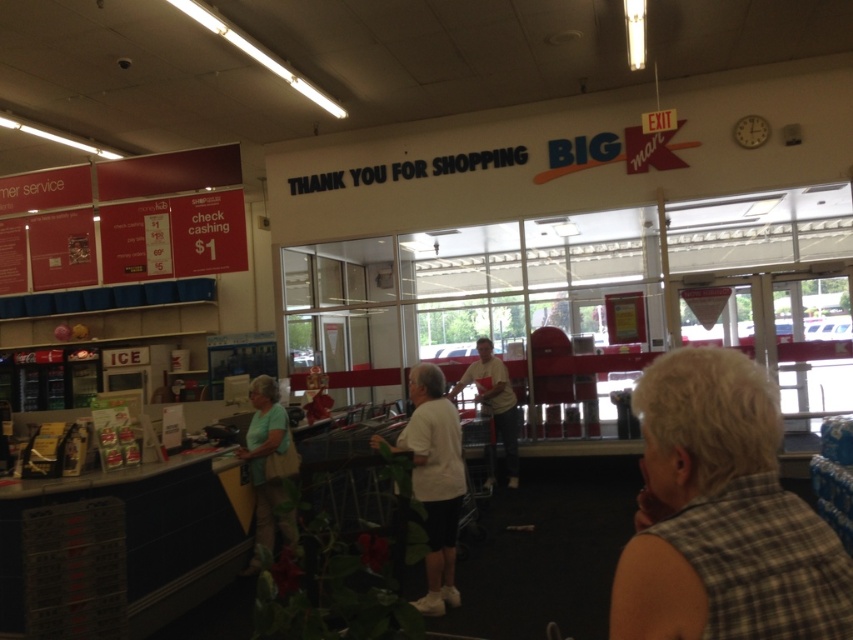
You are a customer at the Big Kmart checkout line. You notice two shirts displayed on mannequins near the checkout counter. The brown plaid shirt at lower right and the white matte shirt at center. Which shirt is positioned closer to the right side of the checkout area?

The brown plaid shirt at lower right is positioned to the right of the white matte shirt at center, so it is closer to the right side of the checkout area.

You are standing at the checkout counter in the Big Kmart store. You notice two points marked on the floor. The first point is at coordinates point (288, 532) and the second is at point (509, 460). If you want to step closer to the camera, which point should you stand on?

You should stand on point (288, 532) because it is closer to the camera than point (509, 460).

Based on the photo, you are a customer at the Big Kmart checkout area and notice two shirts displayed on a rack. The brown plaid shirt at lower right and the white matte shirt at center. Which shirt is placed higher on the rack?

The brown plaid shirt at lower right is positioned over the white matte shirt at center, so it is placed higher on the rack.